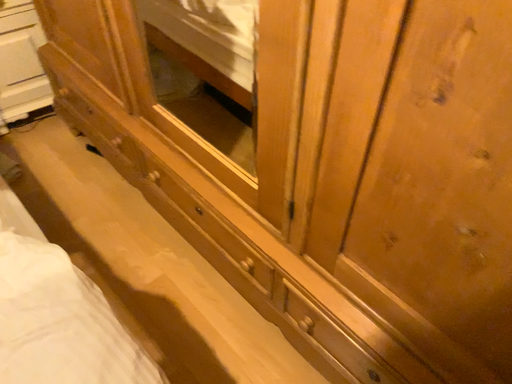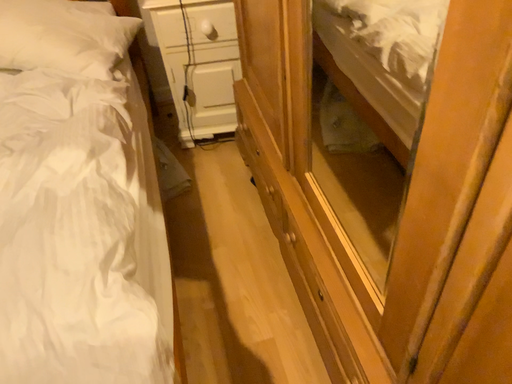
Question: Which way did the camera rotate in the video?

Choices:
 (A) rotated right
 (B) rotated left

Answer: (B)